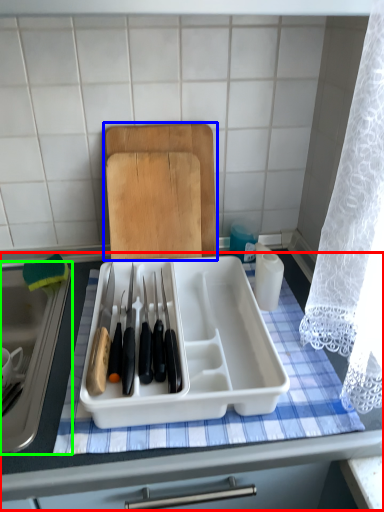
Question: Which object is the farthest from table (highlighted by a red box)? Choose among these: cutting board (highlighted by a blue box) or sink (highlighted by a green box).

Choices:
 (A) cutting board
 (B) sink

Answer: (A)